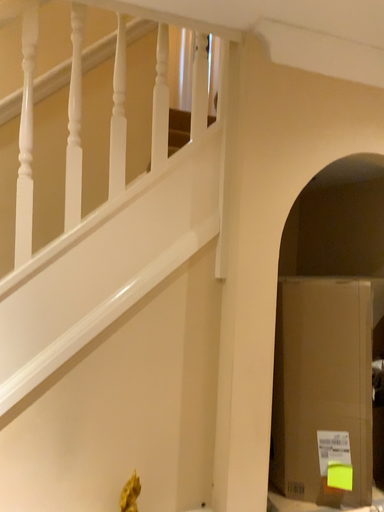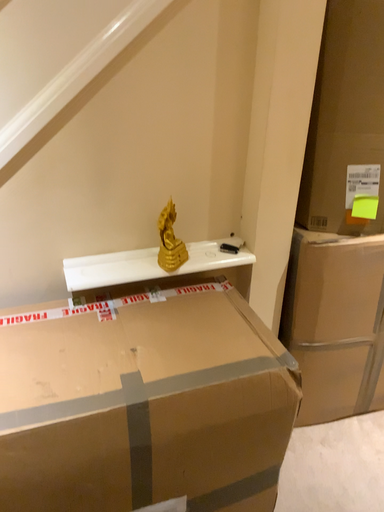
Question: Which way did the camera rotate in the video?

Choices:
 (A) rotated downward
 (B) rotated upward

Answer: (A)